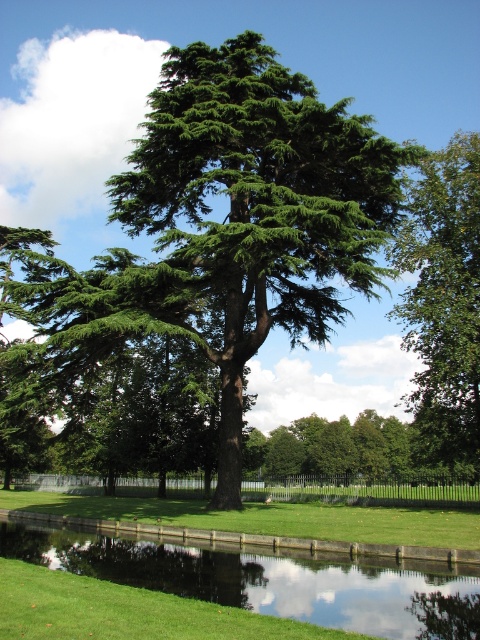
Question: Which is nearer to the green grass at lower center?

Choices:
 (A) green leafy tree at upper right
 (B) green needle-like leaves at center

Answer: (B)

Question: Is green grass at lower center positioned at the back of green leafy tree at upper right?

Choices:
 (A) yes
 (B) no

Answer: (B)

Question: Which of the following is the closest to the observer?

Choices:
 (A) (201, 291)
 (B) (471, 269)

Answer: (A)

Question: Is green needle-like leaves at center below green grass at lower center?

Choices:
 (A) yes
 (B) no

Answer: (B)

Question: Which point is closer to the camera?

Choices:
 (A) (343, 611)
 (B) (182, 176)

Answer: (A)

Question: Can you confirm if green needle-like leaves at center is bigger than green grass at lower center?

Choices:
 (A) yes
 (B) no

Answer: (A)